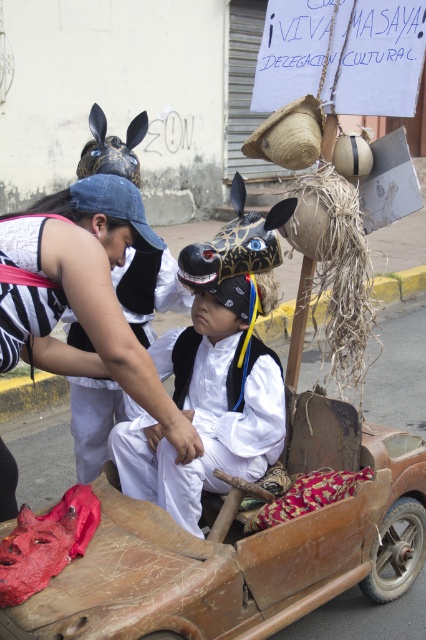
Does white cotton shirt at center have a lesser width compared to white matte vest at center?

Indeed, white cotton shirt at center has a lesser width compared to white matte vest at center.

Based on the photo, which of these two, white cotton shirt at center or white matte vest at center, stands shorter?

With less height is white matte vest at center.

Who is more distant from viewer, (x=112, y=193) or (x=203, y=365)?

Positioned behind is point (x=203, y=365).

Find the location of a particular element. This screenshot has height=640, width=426. white cotton shirt at center is located at coordinates (83, 292).